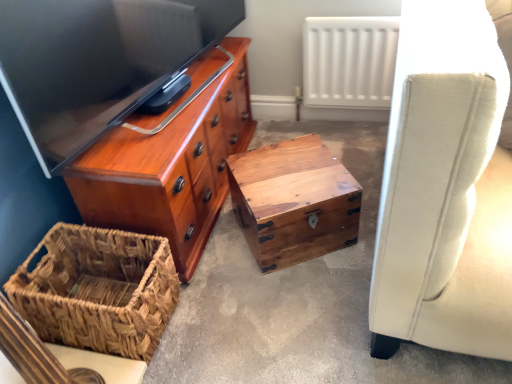
Question: Can you confirm if white matte radiator at upper center is smaller than woven brown picnic basket at lower left?

Choices:
 (A) no
 (B) yes

Answer: (B)

Question: Is white matte radiator at upper center oriented towards woven brown picnic basket at lower left?

Choices:
 (A) yes
 (B) no

Answer: (A)

Question: Would you consider white matte radiator at upper center to be distant from woven brown picnic basket at lower left?

Choices:
 (A) no
 (B) yes

Answer: (B)

Question: Is white matte radiator at upper center oriented away from woven brown picnic basket at lower left?

Choices:
 (A) no
 (B) yes

Answer: (A)

Question: Are white matte radiator at upper center and woven brown picnic basket at lower left making contact?

Choices:
 (A) no
 (B) yes

Answer: (A)

Question: Is white matte radiator at upper center positioned beyond the bounds of woven brown picnic basket at lower left?

Choices:
 (A) yes
 (B) no

Answer: (A)

Question: Can we say wooden chest at center lies outside natural wood trunk at center?

Choices:
 (A) yes
 (B) no

Answer: (A)

Question: From a real-world perspective, is wooden chest at center under natural wood trunk at center?

Choices:
 (A) no
 (B) yes

Answer: (B)

Question: From a real-world perspective, is wooden chest at center on top of natural wood trunk at center?

Choices:
 (A) yes
 (B) no

Answer: (B)

Question: Considering the relative positions of wooden chest at center and natural wood trunk at center in the image provided, is wooden chest at center in front of natural wood trunk at center?

Choices:
 (A) no
 (B) yes

Answer: (B)

Question: Is the position of wooden chest at center more distant than that of natural wood trunk at center?

Choices:
 (A) no
 (B) yes

Answer: (A)

Question: Is wooden chest at center oriented away from natural wood trunk at center?

Choices:
 (A) no
 (B) yes

Answer: (B)

Question: Is wooden chest at center oriented towards woven brown picnic basket at lower left?

Choices:
 (A) no
 (B) yes

Answer: (A)